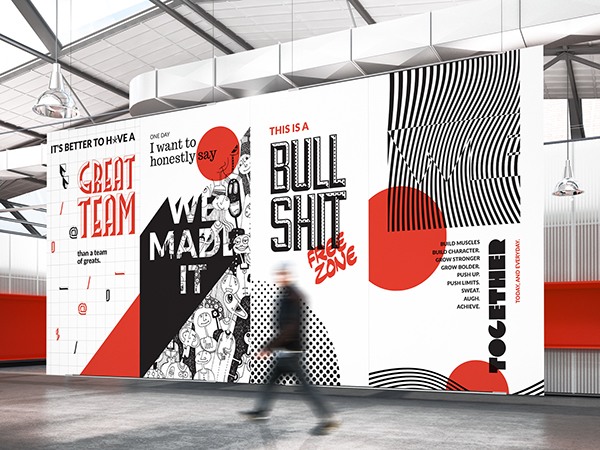
Locate an element on the screen. Image resolution: width=600 pixels, height=450 pixels. white rectangle tile framed ceiling is located at coordinates (153, 48).